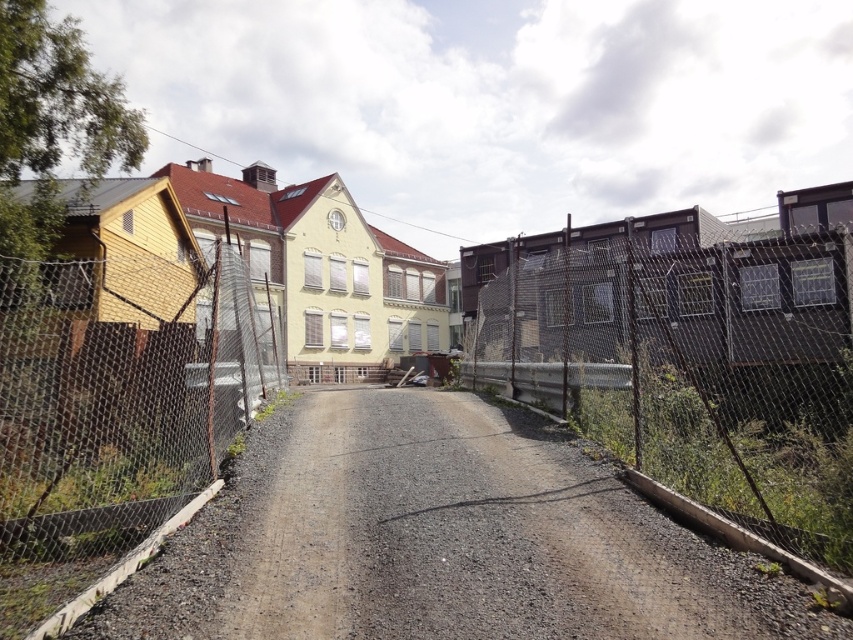
Question: Among these points, which one is farthest from the camera?

Choices:
 (A) (363, 390)
 (B) (128, 333)

Answer: (A)

Question: Is gray gravel road at center to the right of wire mesh fence at left from the viewer's perspective?

Choices:
 (A) yes
 (B) no

Answer: (A)

Question: Which object appears closest to the camera in this image?

Choices:
 (A) rusty chain-link fence at right
 (B) gray gravel road at center
 (C) wire mesh fence at left

Answer: (B)

Question: Does gray gravel road at center have a smaller size compared to wire mesh fence at left?

Choices:
 (A) no
 (B) yes

Answer: (B)

Question: Does gray gravel road at center appear under rusty chain-link fence at right?

Choices:
 (A) yes
 (B) no

Answer: (A)

Question: Which of the following is the farthest from the observer?

Choices:
 (A) gray gravel road at center
 (B) rusty chain-link fence at right
 (C) wire mesh fence at left

Answer: (B)